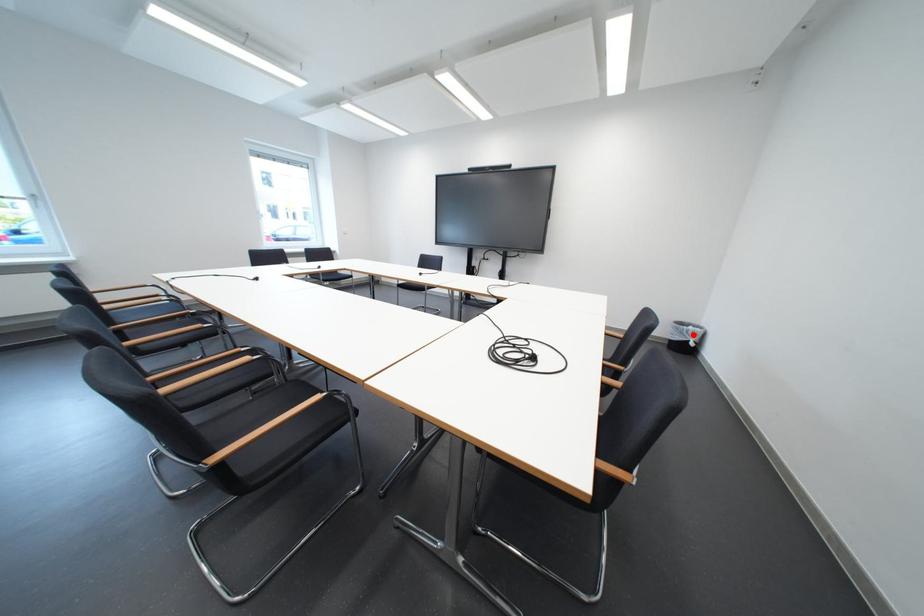
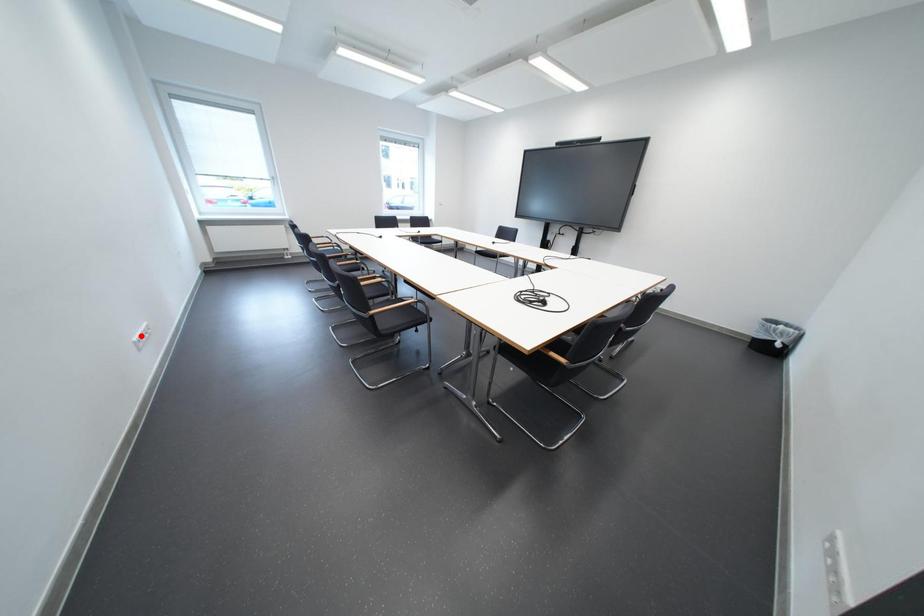
I am providing you with two images of the same scene from different viewpoints. A red point is marked on the first image and another point is marked on the second image. Are the points marked in image1 and image2 representing the same 3D position?

No